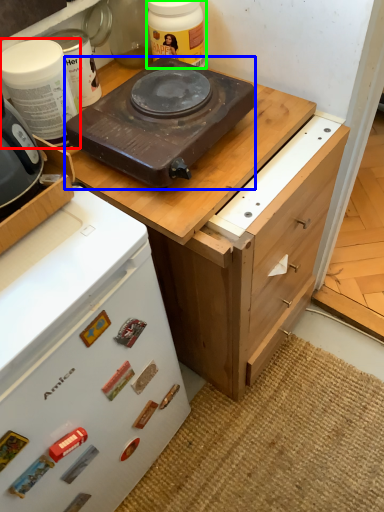
Question: Which is nearer to the kitchen appliance (highlighted by a red box)? kitchen appliance (highlighted by a blue box) or kitchen appliance (highlighted by a green box).

Choices:
 (A) kitchen appliance
 (B) kitchen appliance

Answer: (A)